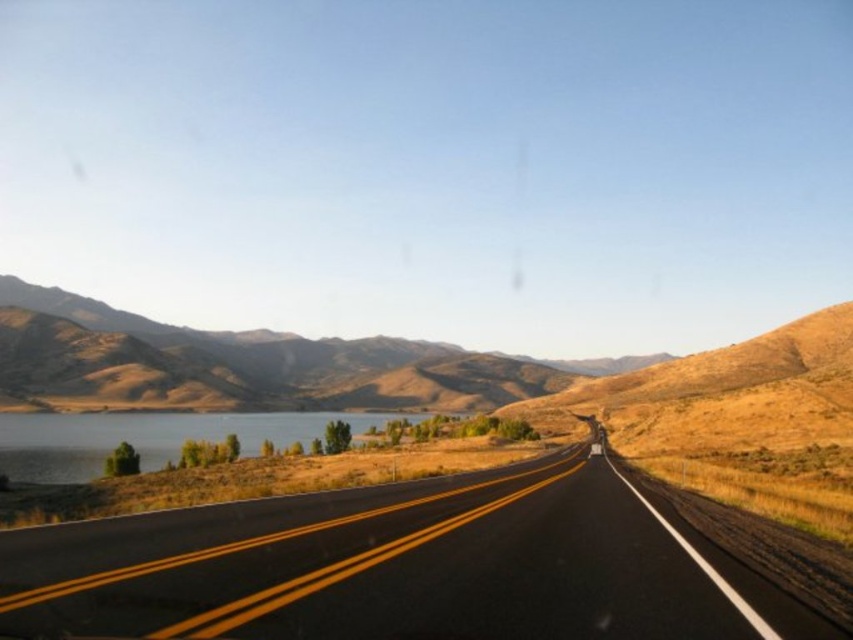
Based on the photo, between black asphalt highway at center and shiny blue water at left, which one is positioned lower?

shiny blue water at left

Is black asphalt highway at center to the left of shiny blue water at left from the viewer's perspective?

Incorrect, black asphalt highway at center is not on the left side of shiny blue water at left.

This screenshot has height=640, width=853. I want to click on black asphalt highway at center, so click(401, 566).

Which of these two, black asphalt highway at center or brown textured hill at left, stands shorter?

With less height is black asphalt highway at center.

Between point (752, 592) and point (213, 380), which one is positioned behind?

The point (213, 380) is more distant.

Locate an element on the screen. The height and width of the screenshot is (640, 853). black asphalt highway at center is located at coordinates (401, 566).

The width and height of the screenshot is (853, 640). What do you see at coordinates (247, 364) in the screenshot? I see `brown textured hill at left` at bounding box center [247, 364].

Between brown textured hill at left and shiny blue water at left, which one appears on the left side from the viewer's perspective?

shiny blue water at left

Does point (155, 356) come closer to viewer compared to point (102, 465)?

No.

Locate an element on the screen. The width and height of the screenshot is (853, 640). brown textured hill at left is located at coordinates (247, 364).